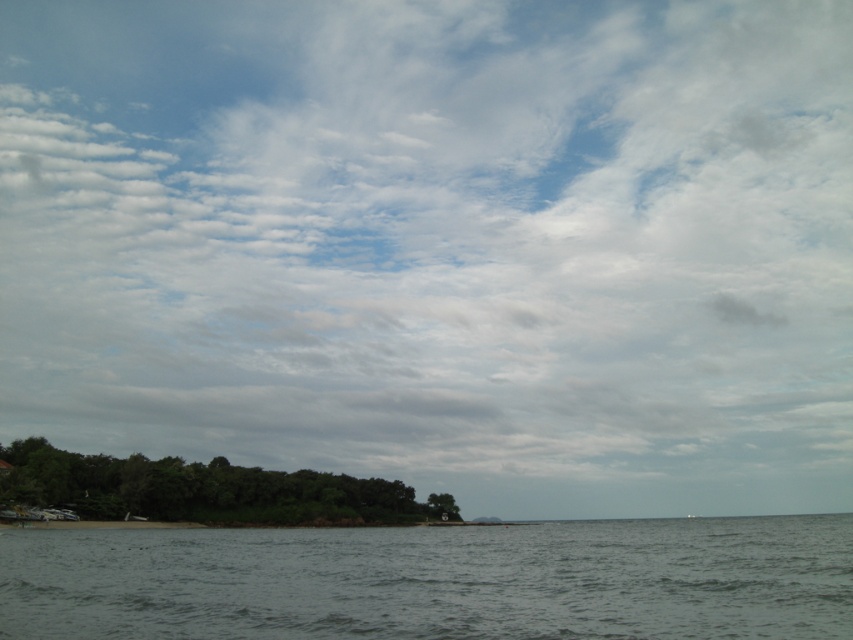
Question: Which of the following is the closest to the observer?

Choices:
 (A) green leafy island at lower left
 (B) gray matte water at lower center

Answer: (B)

Question: Is the position of gray matte water at lower center less distant than that of green leafy island at lower left?

Choices:
 (A) yes
 (B) no

Answer: (A)

Question: Does gray matte water at lower center lie in front of green leafy island at lower left?

Choices:
 (A) yes
 (B) no

Answer: (A)

Question: Does gray matte water at lower center appear on the right side of green leafy island at lower left?

Choices:
 (A) yes
 (B) no

Answer: (A)

Question: Which point is closer to the camera?

Choices:
 (A) green leafy island at lower left
 (B) gray matte water at lower center

Answer: (B)